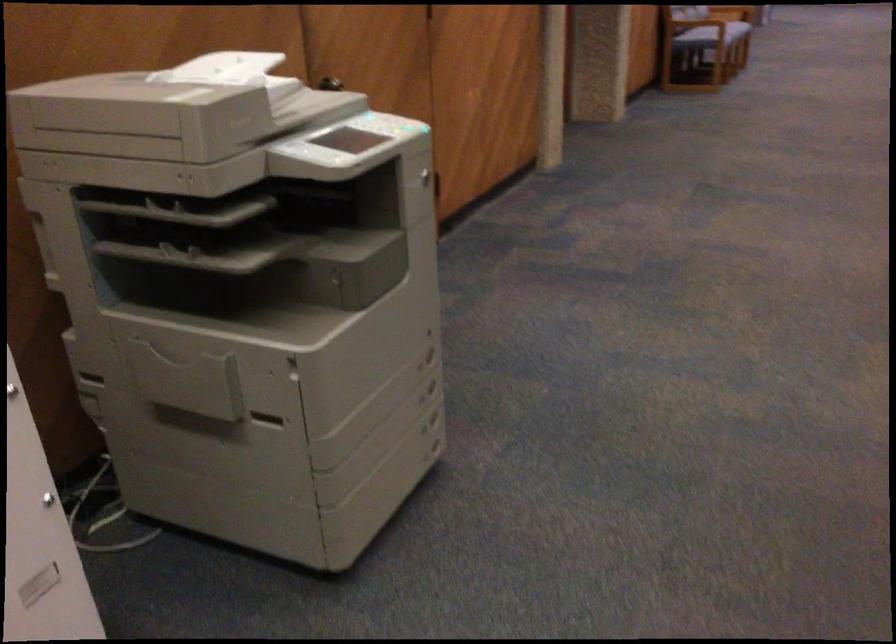
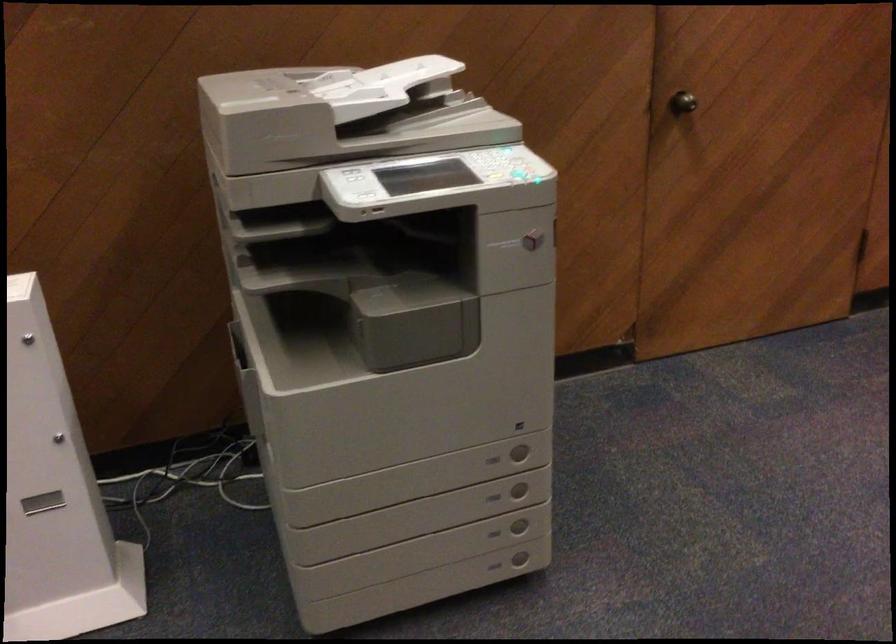
Locate, in the second image, the point that corresponds to point 426,402 in the first image.

(493, 497)